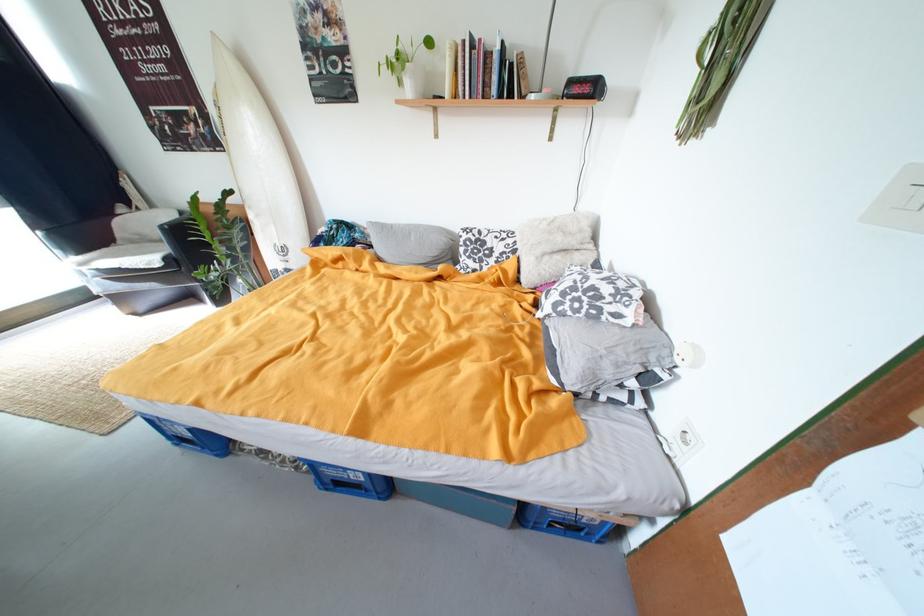
Which object does [414,244] point to?

It corresponds to the white fluffy pillow in the image.